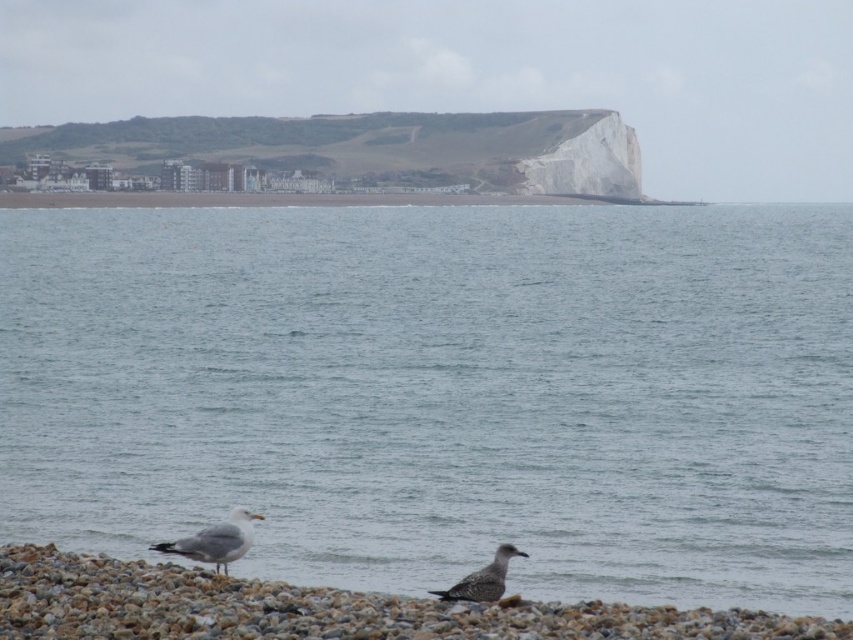
Who is more forward, (28,593) or (508,547)?

Positioned in front is point (28,593).

Can you confirm if gray pebble at lower center is thinner than speckled feathered bird at lower center?

No, gray pebble at lower center is not thinner than speckled feathered bird at lower center.

Where is `gray pebble at lower center`? This screenshot has height=640, width=853. gray pebble at lower center is located at coordinates (321, 609).

The width and height of the screenshot is (853, 640). I want to click on gray pebble at lower center, so click(321, 609).

Does blue water at center have a lesser width compared to speckled feathered bird at lower center?

No, blue water at center is not thinner than speckled feathered bird at lower center.

Can you confirm if blue water at center is wider than speckled feathered bird at lower center?

Yes.

In order to click on blue water at center in this screenshot , I will do `click(442, 392)`.

At what (x,y) coordinates should I click in order to perform the action: click on blue water at center. Please return your answer as a coordinate pair (x, y). Image resolution: width=853 pixels, height=640 pixels. Looking at the image, I should click on (442, 392).

Can you confirm if gray matte seagull at lower left is shorter than speckled feathered bird at lower center?

No.

Does gray matte seagull at lower left have a greater height compared to speckled feathered bird at lower center?

Yes, gray matte seagull at lower left is taller than speckled feathered bird at lower center.

Locate an element on the screen. The width and height of the screenshot is (853, 640). gray matte seagull at lower left is located at coordinates (216, 540).

Locate an element on the screen. This screenshot has height=640, width=853. gray matte seagull at lower left is located at coordinates (216, 540).